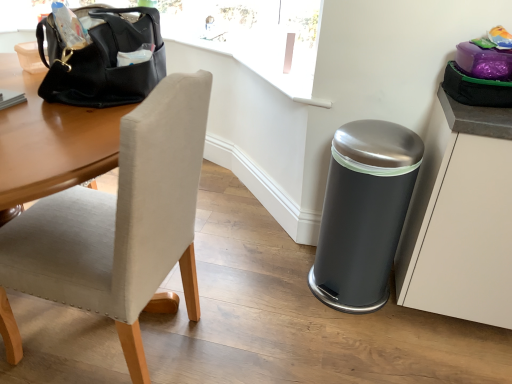
Where is `vacant region below beige fabric chair at left (from a real-world perspective)`? The height and width of the screenshot is (384, 512). vacant region below beige fabric chair at left (from a real-world perspective) is located at coordinates (114, 345).